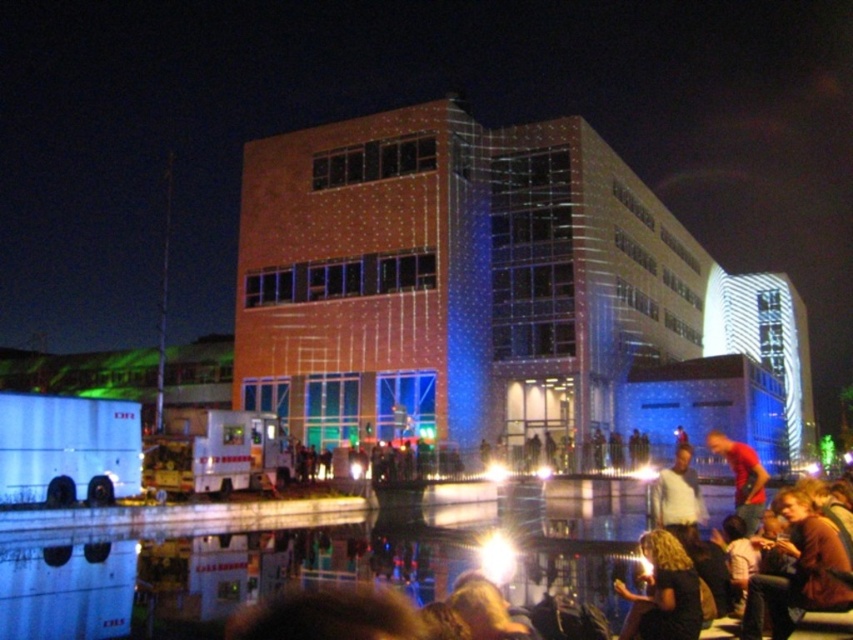
You are standing at the center of the waterfront scene and notice a person with dark hair at lower right. Where would you look to find their reflection in the water?

The dark hair at lower right is located at point (663, 593), so their reflection would be directly below them in the water at the same horizontal position but mirrored vertically.